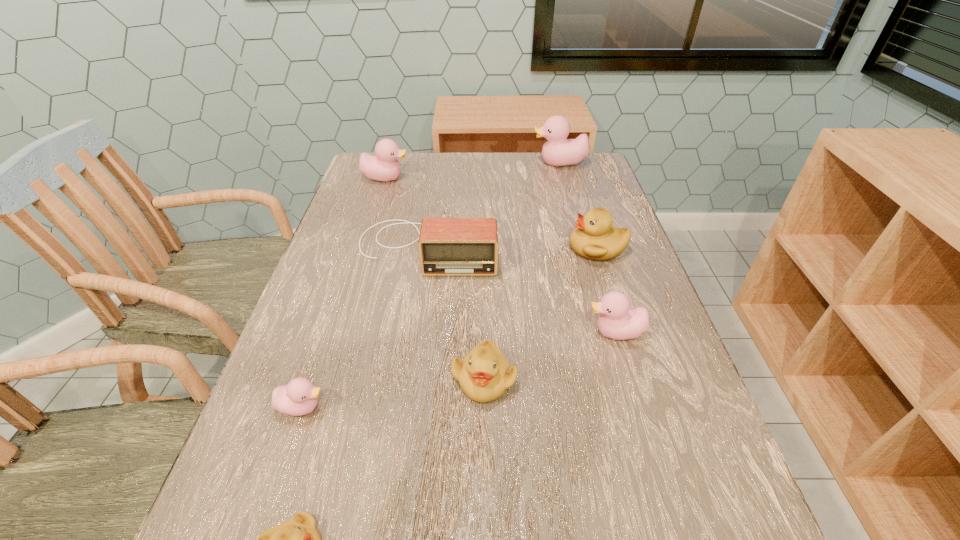
Identify the location of the tallest duckling. (558, 151).

What are the coordinates of `the biggest pink duckling` in the screenshot? It's located at pos(558,151).

Locate an element on the screen. This screenshot has height=540, width=960. the second biggest pink duckling is located at coordinates (385, 167).

Locate an element on the screen. This screenshot has width=960, height=540. the rightmost yellow duckling is located at coordinates (595, 238).

Locate an element on the screen. This screenshot has width=960, height=540. the biggest yellow duckling is located at coordinates [x=595, y=238].

The width and height of the screenshot is (960, 540). In order to click on radio receiver in this screenshot , I will do `click(447, 246)`.

Find the location of a particular element. The image size is (960, 540). the fourth farthest duckling is located at coordinates (618, 321).

Where is `the fourth nearest object`? the fourth nearest object is located at coordinates (618, 321).

The image size is (960, 540). What are the coordinates of `the second smallest yellow duckling` in the screenshot? It's located at (484, 374).

Locate an element on the screen. Image resolution: width=960 pixels, height=540 pixels. the second yellow duckling from left to right is located at coordinates (484, 374).